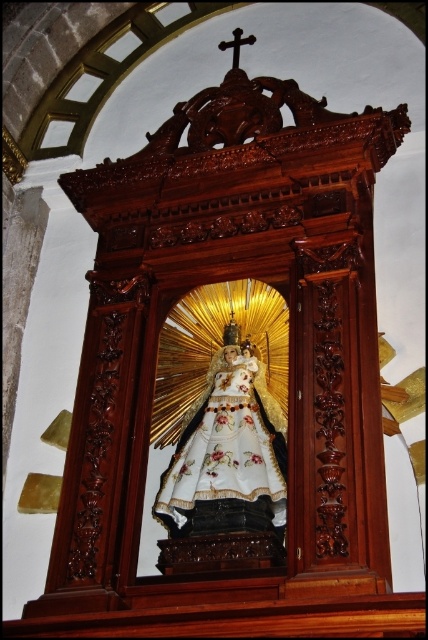
Question: Does white satin robe at center appear under polished dark wood cross at upper center?

Choices:
 (A) no
 (B) yes

Answer: (B)

Question: Among these points, which one is farthest from the camera?

Choices:
 (A) (231, 349)
 (B) (234, 60)

Answer: (B)

Question: Among these objects, which one is farthest from the camera?

Choices:
 (A) polished dark wood cross at upper center
 (B) white satin robe at center

Answer: (A)

Question: Is white satin robe at center wider than polished dark wood cross at upper center?

Choices:
 (A) no
 (B) yes

Answer: (B)

Question: Which object is closer to the camera taking this photo?

Choices:
 (A) white satin robe at center
 (B) polished dark wood cross at upper center

Answer: (A)

Question: Can you confirm if white satin robe at center is positioned to the left of polished dark wood cross at upper center?

Choices:
 (A) no
 (B) yes

Answer: (B)